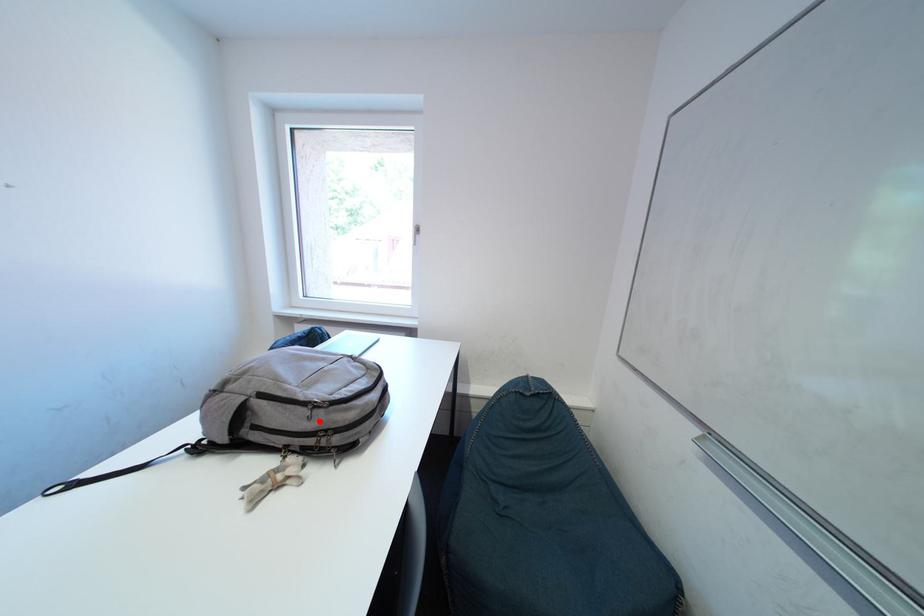
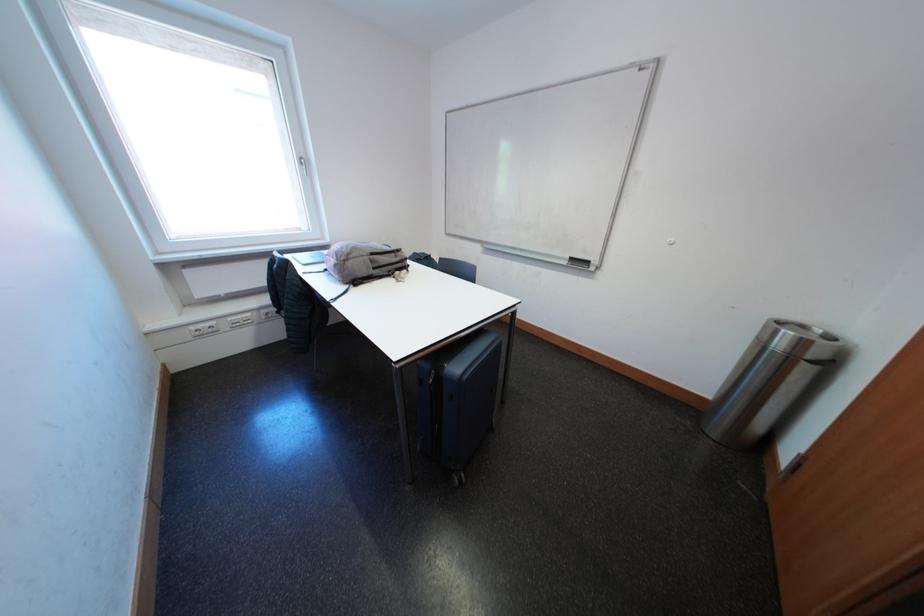
In the second image, find the point that corresponds to the highlighted location in the first image.

(406, 261)